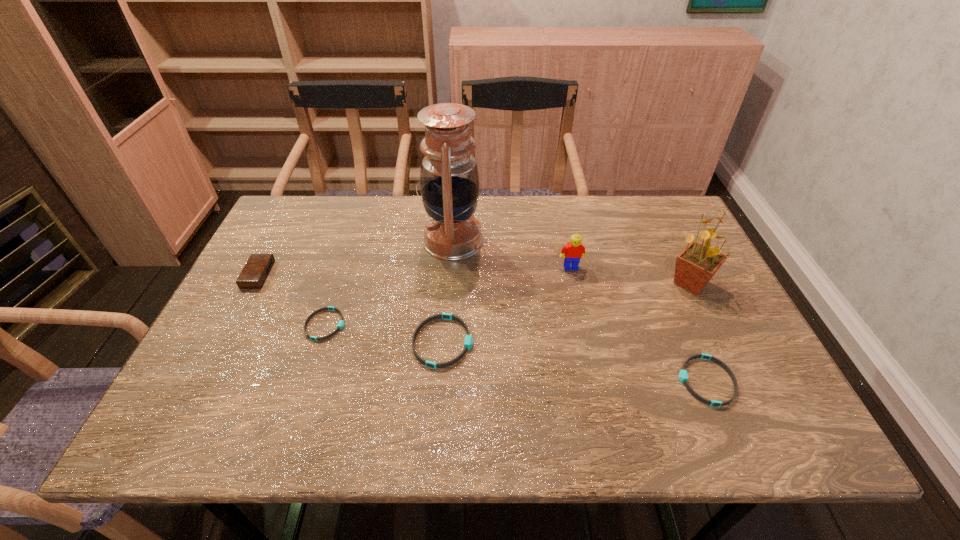
Please point a space for a new wristband to maintain equal intervals. Please provide its 2D coordinates. Your answer should be formatted as a tuple, i.e. [(x, y)], where the tuple contains the x and y coordinates of a point satisfying the conditions above.

[(569, 361)]